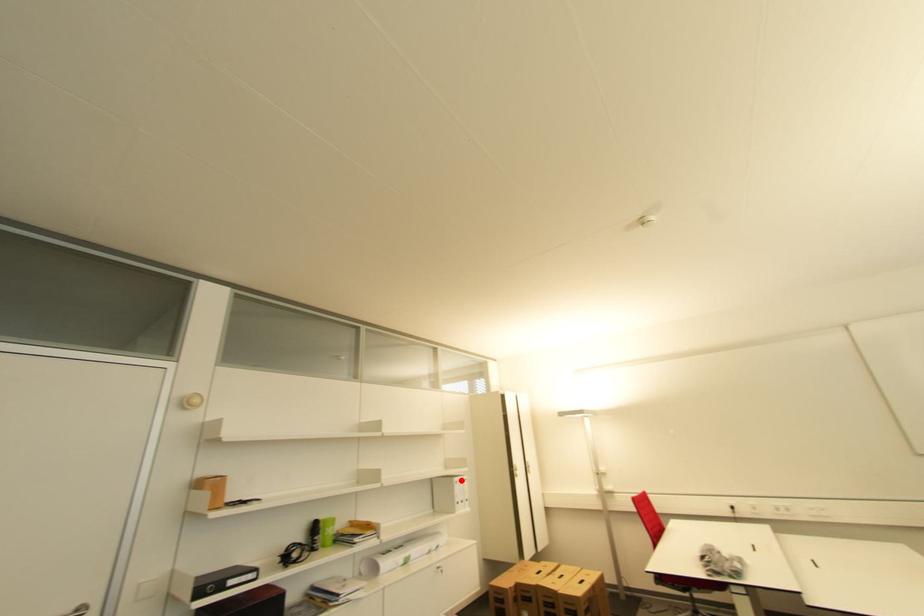
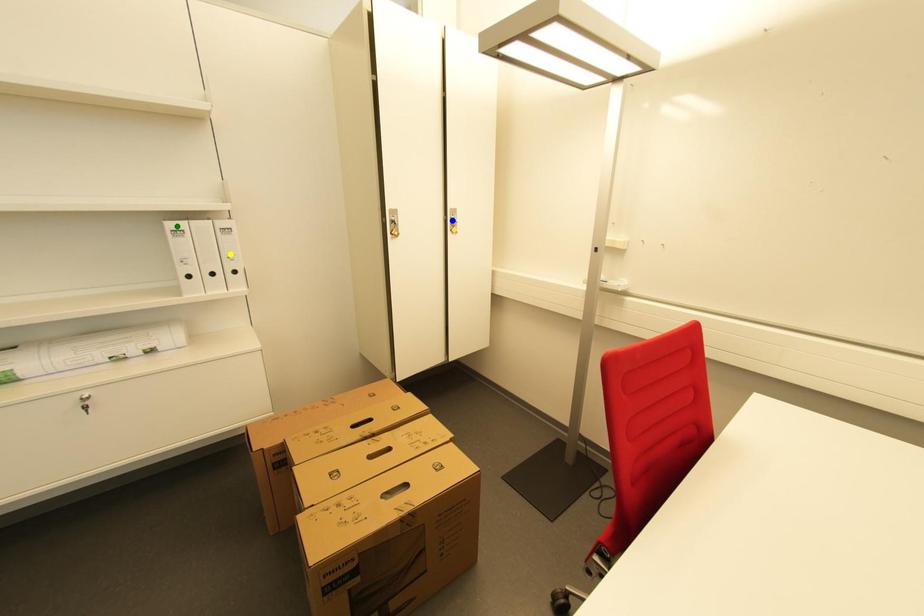
Question: I am providing you with two images of the same scene from different viewpoints. A red point is marked on the first image. You are given multiple points on the second image. In image 2, which mark is for the same physical point as the one in image 1?

Choices:
 (A) blue point
 (B) green point
 (C) yellow point

Answer: (B)